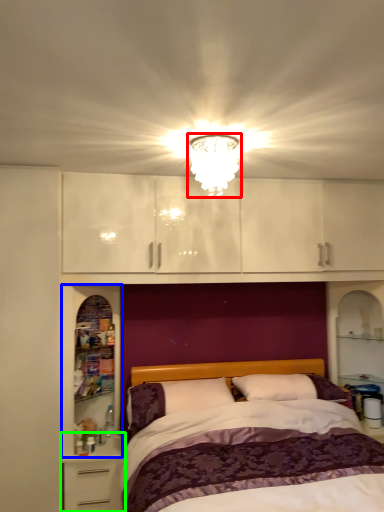
Question: Estimate the real-world distances between objects in this image. Which object is closer to light fixture (highlighted by a red box), cabinet (highlighted by a blue box) or nightstand (highlighted by a green box)?

Choices:
 (A) cabinet
 (B) nightstand

Answer: (A)